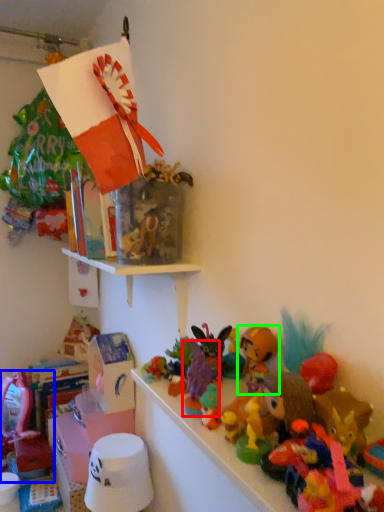
Question: Which is farther away from toy (highlighted by a red box)? toy (highlighted by a blue box) or toy (highlighted by a green box)?

Choices:
 (A) toy
 (B) toy

Answer: (A)